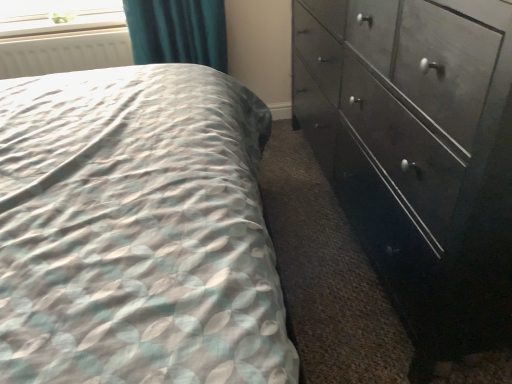
Question: Should I look upward or downward to see clear plastic window screen at upper left?

Choices:
 (A) down
 (B) up

Answer: (B)

Question: Is white matte radiator at upper left located within dark wood dresser at right?

Choices:
 (A) no
 (B) yes

Answer: (A)

Question: Is dark wood dresser at right at the left side of white matte radiator at upper left?

Choices:
 (A) no
 (B) yes

Answer: (A)

Question: Does dark wood dresser at right appear on the right side of white matte radiator at upper left?

Choices:
 (A) no
 (B) yes

Answer: (B)

Question: Is dark wood dresser at right smaller than white matte radiator at upper left?

Choices:
 (A) no
 (B) yes

Answer: (A)

Question: From the image's perspective, is dark wood dresser at right on top of white matte radiator at upper left?

Choices:
 (A) yes
 (B) no

Answer: (B)

Question: Can you confirm if dark wood dresser at right is wider than white matte radiator at upper left?

Choices:
 (A) no
 (B) yes

Answer: (B)

Question: Does white matte radiator at upper left have a lesser height compared to dark wood dresser at right?

Choices:
 (A) no
 (B) yes

Answer: (B)

Question: Does white matte radiator at upper left have a larger size compared to dark wood dresser at right?

Choices:
 (A) yes
 (B) no

Answer: (B)

Question: Does white matte radiator at upper left appear on the left side of dark wood dresser at right?

Choices:
 (A) yes
 (B) no

Answer: (A)

Question: Is white matte radiator at upper left oriented towards dark wood dresser at right?

Choices:
 (A) no
 (B) yes

Answer: (A)

Question: Considering the relative sizes of white matte radiator at upper left and dark wood dresser at right in the image provided, is white matte radiator at upper left taller than dark wood dresser at right?

Choices:
 (A) no
 (B) yes

Answer: (A)

Question: Is white matte radiator at upper left at the right side of dark wood dresser at right?

Choices:
 (A) yes
 (B) no

Answer: (B)

Question: Is dark wood dresser at right closer to camera compared to clear plastic window screen at upper left?

Choices:
 (A) yes
 (B) no

Answer: (A)